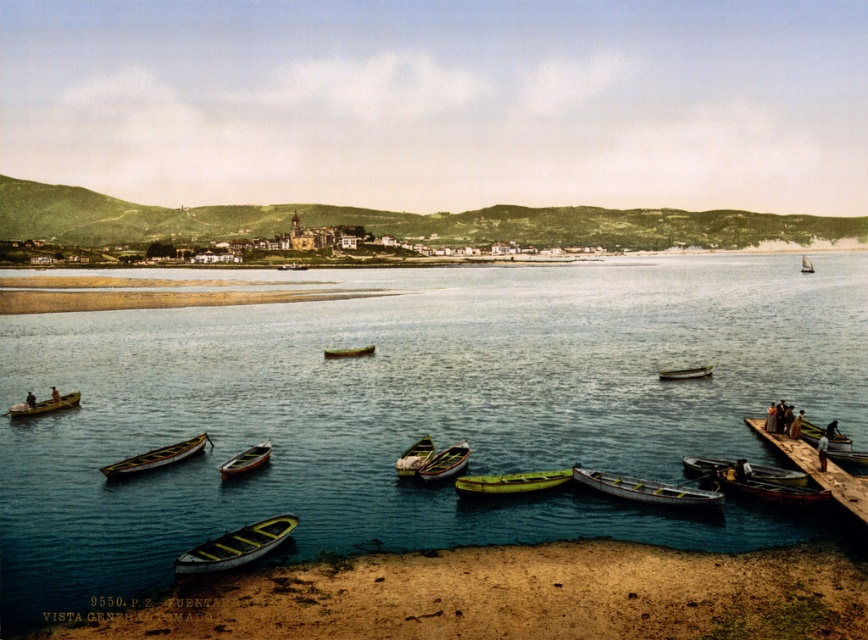
Which of these two, wooden canoe at center or green matte boat at center, stands shorter?

With less height is green matte boat at center.

Who is more distant from viewer, [262,456] or [337,356]?

The point [337,356] is more distant.

What are the coordinates of `wooden canoe at center` in the screenshot? It's located at (245, 460).

Is wooden canoe at center further to the viewer compared to green wooden boat at center?

That is False.

Which is above, wooden canoe at center or green wooden boat at center?

green wooden boat at center is above.

Locate an element on the screen. Image resolution: width=868 pixels, height=640 pixels. wooden canoe at center is located at coordinates (245, 460).

Does point (452, 392) come farther from viewer compared to point (777, 477)?

Yes, point (452, 392) is behind point (777, 477).

The image size is (868, 640). What do you see at coordinates (413, 410) in the screenshot?
I see `clear blue water at center` at bounding box center [413, 410].

Describe the element at coordinates (413, 410) in the screenshot. I see `clear blue water at center` at that location.

This screenshot has width=868, height=640. In order to click on clear blue water at center in this screenshot , I will do `click(413, 410)`.